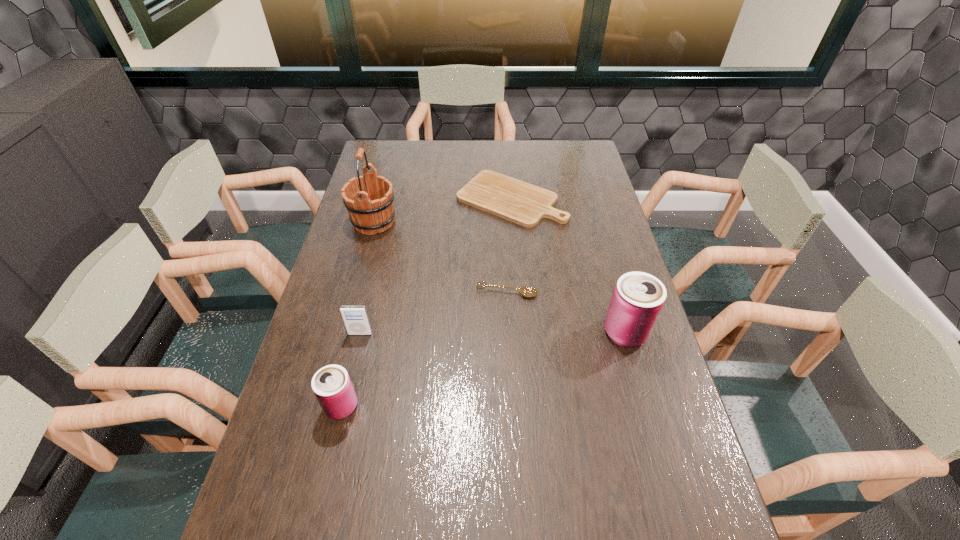
The height and width of the screenshot is (540, 960). Identify the location of vacant space located 0.350m on the front of the taller can. (670, 491).

Locate an element on the screen. The width and height of the screenshot is (960, 540). vacant space located on the front of the shortest object is located at coordinates (520, 319).

This screenshot has height=540, width=960. In order to click on vacant space located on the back of the tallest object in this screenshot , I will do `click(381, 194)`.

You are a GUI agent. You are given a task and a screenshot of the screen. Output one action in this format:
    pyautogui.click(x=<x>, y=<y>)
    Task: Click on the vacant space situated on the front-facing side of the iPod
    
    Given the screenshot: What is the action you would take?
    [x=351, y=370]

I want to click on vacant area situated 0.050m on the front of the fourth nearest object, so click(508, 313).

Identify the location of can situated at the left edge. The image size is (960, 540). (332, 386).

You are a GUI agent. You are given a task and a screenshot of the screen. Output one action in this format:
    pyautogui.click(x=<x>, y=<y>)
    Task: Click on the wine bucket located in the left edge section of the desktop
    The height and width of the screenshot is (540, 960).
    Given the screenshot: What is the action you would take?
    pyautogui.click(x=373, y=212)

At what (x,y) coordinates should I click in order to perform the action: click on iPod located in the left edge section of the desktop. Please return your answer as a coordinate pair (x, y). Looking at the image, I should click on (355, 318).

Locate an element on the screen. can that is at the right edge is located at coordinates (638, 298).

This screenshot has height=540, width=960. I want to click on chopping board located in the right edge section of the desktop, so click(519, 202).